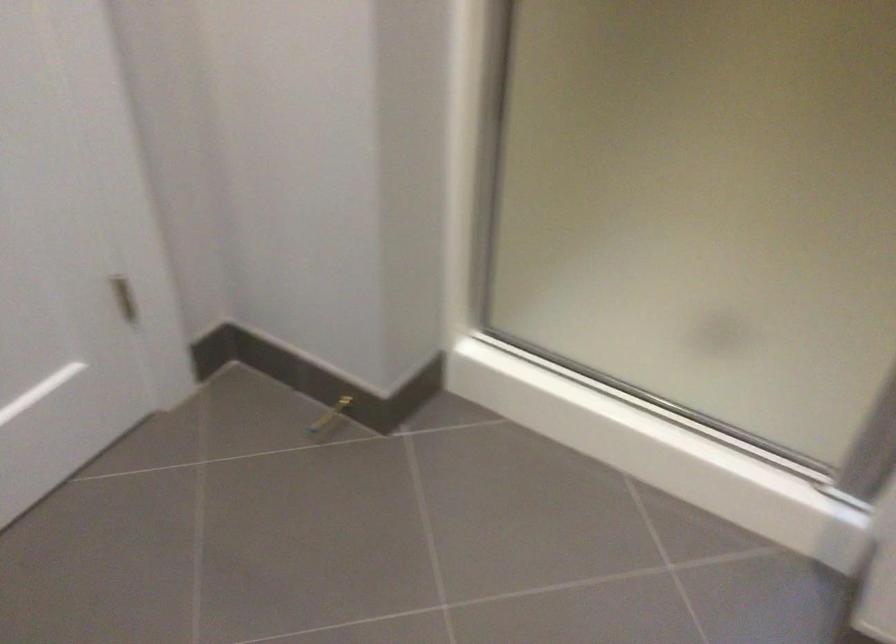
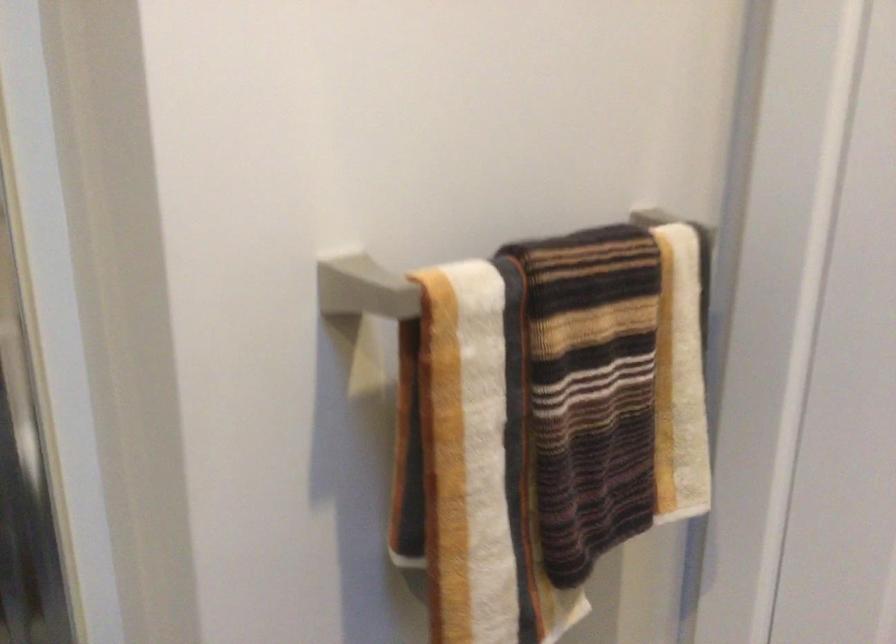
Question: The images are taken continuously from a first-person perspective. In which direction is your viewpoint rotating?

Choices:
 (A) Left
 (B) Right
 (C) Up
 (D) Down

Answer: (B)